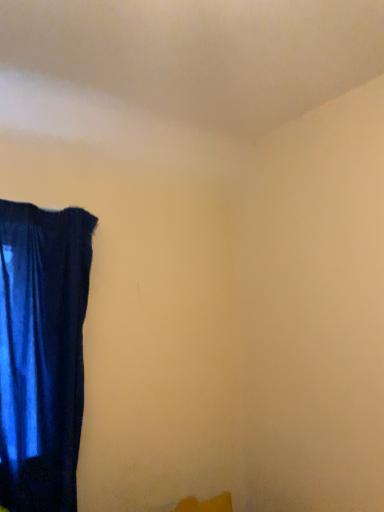
The width and height of the screenshot is (384, 512). What do you see at coordinates (42, 353) in the screenshot?
I see `velvet blue curtain at left` at bounding box center [42, 353].

In order to click on velvet blue curtain at left in this screenshot , I will do `click(42, 353)`.

The width and height of the screenshot is (384, 512). I want to click on velvet blue curtain at left, so click(42, 353).